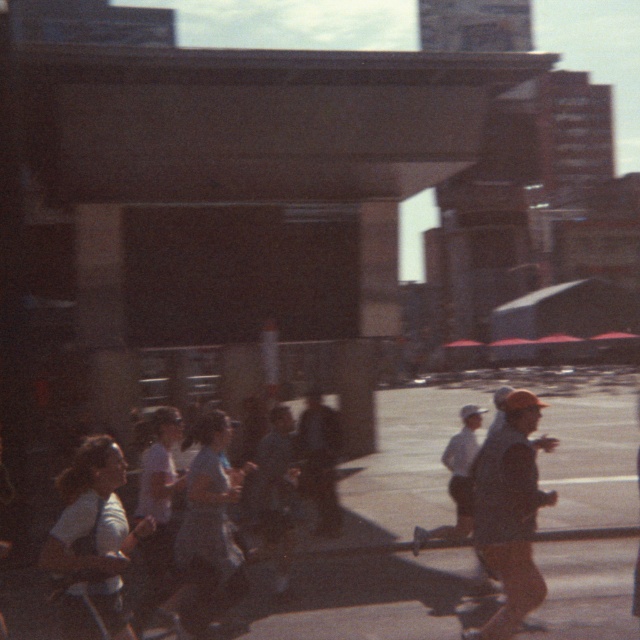
Does smooth asphalt road at center appear under orange cap at right?

Indeed, smooth asphalt road at center is positioned under orange cap at right.

Who is positioned more to the right, smooth asphalt road at center or orange cap at right?

From the viewer's perspective, smooth asphalt road at center appears more on the right side.

This screenshot has height=640, width=640. Describe the element at coordinates (380, 538) in the screenshot. I see `smooth asphalt road at center` at that location.

Where is `smooth asphalt road at center`? smooth asphalt road at center is located at coordinates (380, 538).